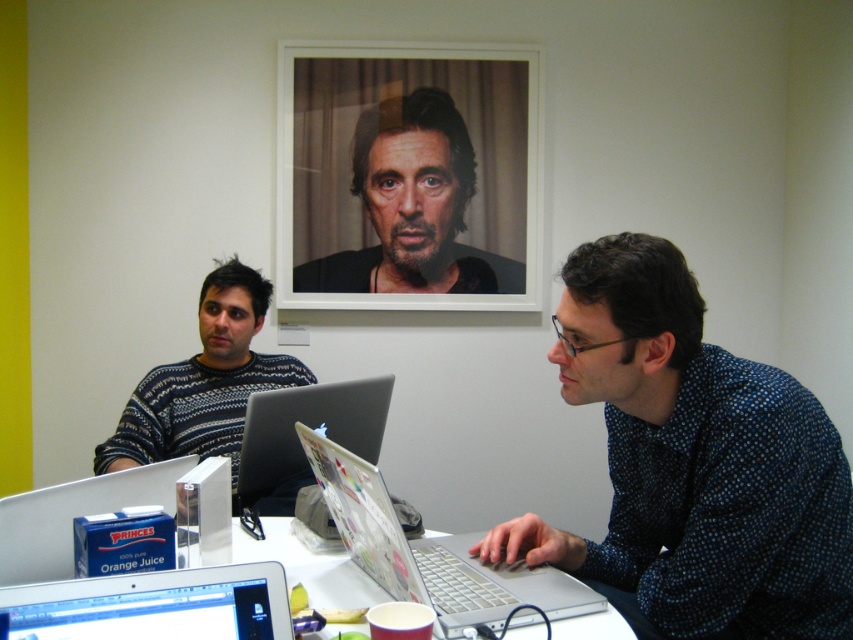
Is point (396, 534) closer to viewer compared to point (527, 632)?

Yes, point (396, 534) is closer to viewer.

Between silver metallic laptop at center and white plastic table at center, which one appears on the right side from the viewer's perspective?

Positioned to the right is silver metallic laptop at center.

Who is more forward, (x=456, y=547) or (x=607, y=636)?

Point (x=607, y=636)

Find the location of a particular element. Image resolution: width=853 pixels, height=640 pixels. silver metallic laptop at center is located at coordinates (430, 552).

Can you confirm if silver metallic laptop at lower left is positioned to the left of white plastic table at center?

Correct, you'll find silver metallic laptop at lower left to the left of white plastic table at center.

Based on the photo, between silver metallic laptop at lower left and white plastic table at center, which one appears on the left side from the viewer's perspective?

silver metallic laptop at lower left

This screenshot has height=640, width=853. Find the location of `silver metallic laptop at lower left`. silver metallic laptop at lower left is located at coordinates (154, 605).

Find the location of a particular element. The width and height of the screenshot is (853, 640). silver metallic laptop at lower left is located at coordinates (154, 605).

Can you confirm if dark blue sweater at left is smaller than satin silver laptop at center?

No, dark blue sweater at left is not smaller than satin silver laptop at center.

Does dark blue sweater at left appear on the left side of satin silver laptop at center?

Indeed, dark blue sweater at left is positioned on the left side of satin silver laptop at center.

Between point (167, 396) and point (374, 416), which one is positioned in front?

Point (374, 416)

Identify the location of dark blue sweater at left. (204, 381).